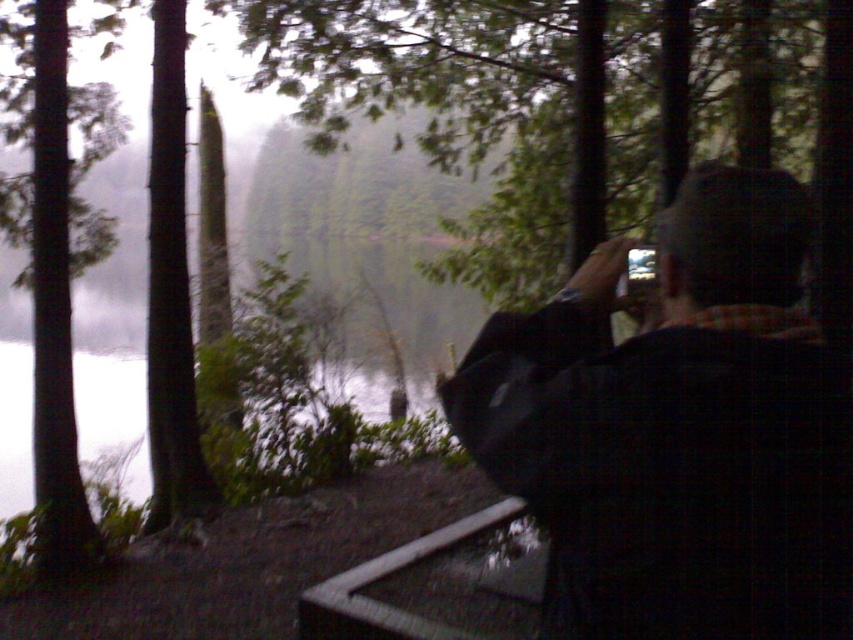
You are standing in the forest scene and want to walk from point A to point B. Point A is at coordinate point (582,461) and point B is at coordinate point (83,150). Which point should you start walking from to reach the other point without going through the misty areas?

You should start at point A at coordinate point (582,461) because it is closer to the viewer, so walking towards point B at coordinate point (83,150) would be moving away from the misty areas.